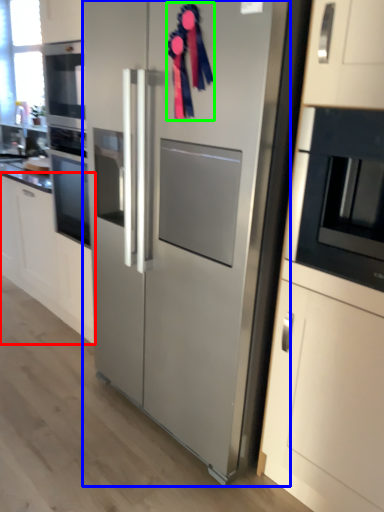
Question: Considering the real-world distances, which object is farthest from cabinetry (highlighted by a red box)? refrigerator (highlighted by a blue box) or ribbon (highlighted by a green box)?

Choices:
 (A) refrigerator
 (B) ribbon

Answer: (B)